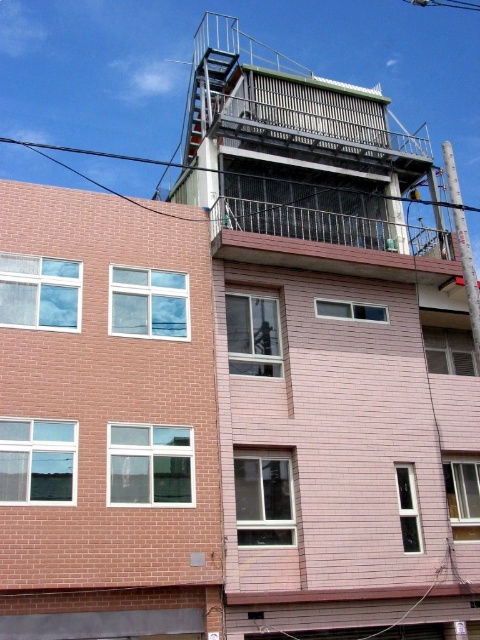
You are a maintenance worker needing to install a new light fixture. You have two options for placement based on the image. The brown textured balcony at upper center and the black wire at upper left. Which location has more space to accommodate the fixture?

The black wire at upper left has more space since the brown textured balcony at upper center is smaller than the black wire at upper left.

You are standing at the base of the building and looking up. There is a point marked at coordinates (328,241). Based on the scene description, can you identify what structure or feature this point is located on?

The point (328,241) is located on the brown textured balcony at upper center.

You are standing at the base of the residential building and want to reach the rooftop platform. A drone is needed to deliver a package to a point located at coordinates point (414, 237). What is the minimum altitude the drone must ascend to reach this point?

The point (414, 237) is 115.65 feet away from the camera, so the drone must ascend to at least 115.65 feet to reach it.